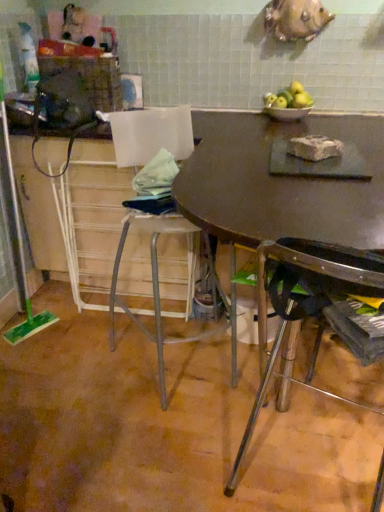
At what (x,y) coordinates should I click in order to perform the action: click on free space between matte brown table at center and metallic silver stool at center, marked as the first chair in a left-to-right arrangement. Please return your answer as a coordinate pair (x, y). Looking at the image, I should click on (132, 408).